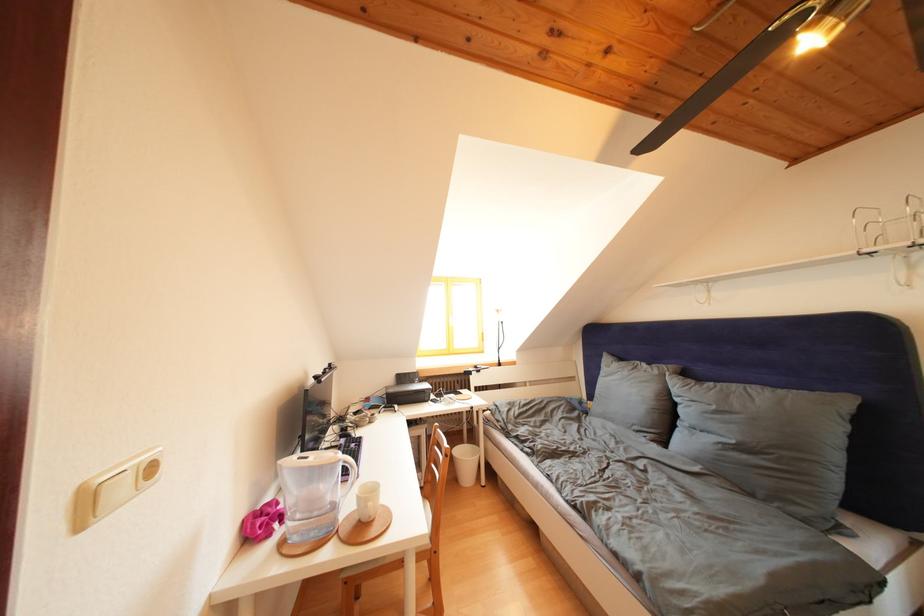
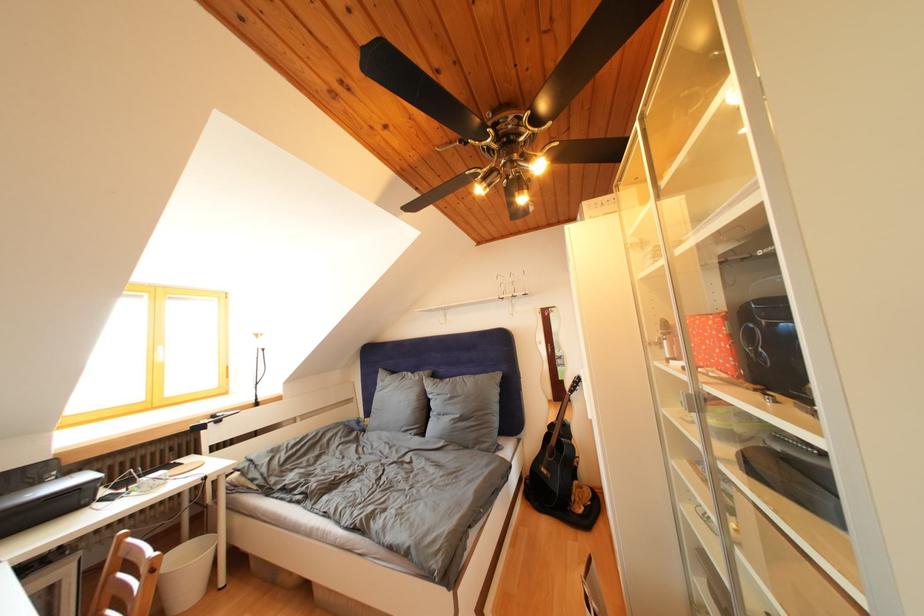
Locate, in the second image, the point that corresponds to point 663,377 in the first image.

(426, 383)